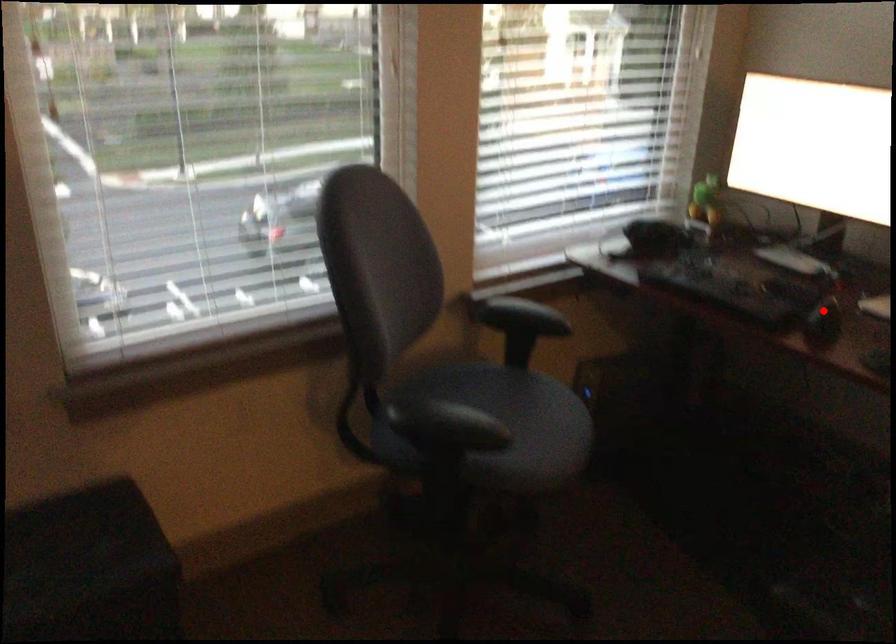
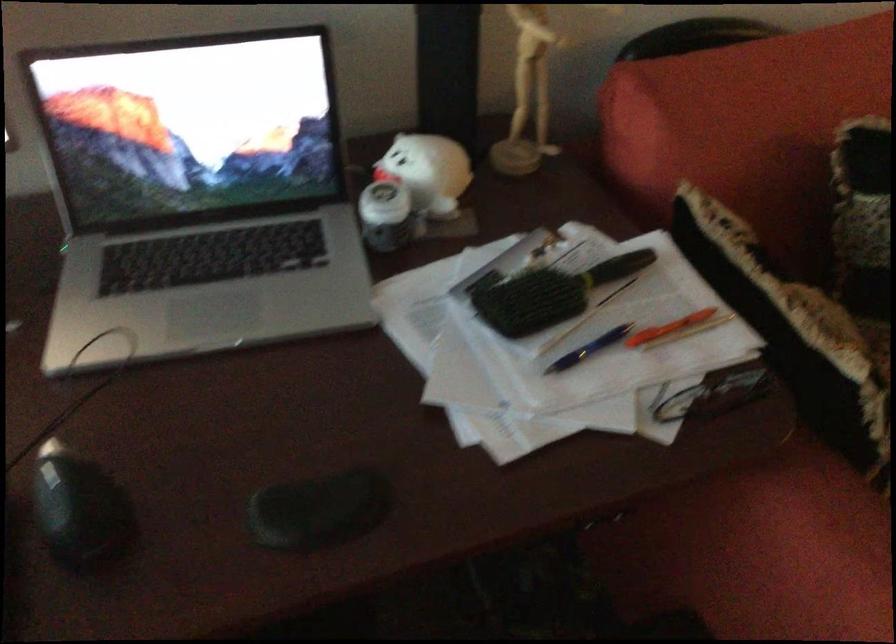
In the second image, find the point that corresponds to the highlighted location in the first image.

(80, 511)